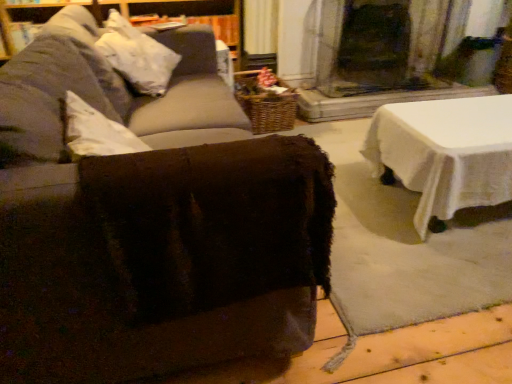
Question: Should I look upward or downward to see woven brown basket at center?

Choices:
 (A) down
 (B) up

Answer: (B)

Question: Is brown fuzzy ottoman at center positioned in front of woven brown basket at center?

Choices:
 (A) no
 (B) yes

Answer: (B)

Question: Is brown fuzzy ottoman at center to the left of woven brown basket at center from the viewer's perspective?

Choices:
 (A) yes
 (B) no

Answer: (A)

Question: Is brown fuzzy ottoman at center behind woven brown basket at center?

Choices:
 (A) yes
 (B) no

Answer: (B)

Question: Is brown fuzzy ottoman at center wider than woven brown basket at center?

Choices:
 (A) yes
 (B) no

Answer: (A)

Question: Is brown fuzzy ottoman at center to the right of woven brown basket at center from the viewer's perspective?

Choices:
 (A) yes
 (B) no

Answer: (B)

Question: From the image's perspective, is brown fuzzy ottoman at center on woven brown basket at center?

Choices:
 (A) yes
 (B) no

Answer: (B)

Question: From the image's perspective, is brown fuzzy ottoman at center beneath white fabric pillow at upper left?

Choices:
 (A) no
 (B) yes

Answer: (B)

Question: From a real-world perspective, does brown fuzzy ottoman at center sit lower than white fabric pillow at upper left?

Choices:
 (A) no
 (B) yes

Answer: (B)

Question: Can you confirm if brown fuzzy ottoman at center is wider than white fabric pillow at upper left?

Choices:
 (A) no
 (B) yes

Answer: (B)

Question: Can you confirm if brown fuzzy ottoman at center is positioned to the right of white fabric pillow at upper left?

Choices:
 (A) no
 (B) yes

Answer: (B)

Question: Is brown fuzzy ottoman at center turned away from white fabric pillow at upper left?

Choices:
 (A) no
 (B) yes

Answer: (B)

Question: Is brown fuzzy ottoman at center outside white fabric pillow at upper left?

Choices:
 (A) yes
 (B) no

Answer: (A)

Question: Does white fabric pillow at upper left appear on the left side of brown fuzzy ottoman at center?

Choices:
 (A) no
 (B) yes

Answer: (B)